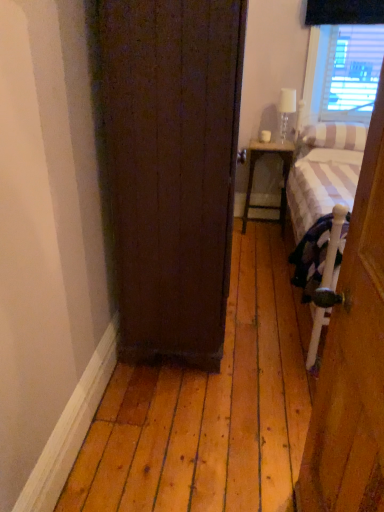
Question: From a real-world perspective, is white striped pillow at right, the 1th pillow when ordered from top to bottom, below dark wood door at center, arranged as the second door when viewed from the front?

Choices:
 (A) no
 (B) yes

Answer: (A)

Question: From the image's perspective, is white striped pillow at right, the 1th pillow when ordered from top to bottom, over dark wood door at center, arranged as the second door when viewed from the front?

Choices:
 (A) yes
 (B) no

Answer: (A)

Question: Is white striped pillow at right, the 1th pillow when ordered from top to bottom, placed right next to dark wood door at center, which is the 2th door from right to left?

Choices:
 (A) no
 (B) yes

Answer: (A)

Question: Does white striped pillow at right, placed as the second pillow when sorted from bottom to top, have a lesser height compared to dark wood door at center, arranged as the second door when viewed from the front?

Choices:
 (A) no
 (B) yes

Answer: (B)

Question: Is white striped pillow at right, the 1th pillow when ordered from top to bottom, facing towards dark wood door at center, placed as the 1th door when sorted from left to right?

Choices:
 (A) yes
 (B) no

Answer: (B)

Question: Which is correct: white striped pillow at right, which is the second pillow in top-to-bottom order, is inside white striped fabric bed at right, or outside of it?

Choices:
 (A) outside
 (B) inside

Answer: (B)

Question: Is point (304, 155) closer or farther from the camera than point (312, 142)?

Choices:
 (A) closer
 (B) farther

Answer: (B)

Question: Considering the positions of white striped pillow at right, which is the second pillow in top-to-bottom order, and white striped fabric bed at right in the image, is white striped pillow at right, which is the second pillow in top-to-bottom order, bigger or smaller than white striped fabric bed at right?

Choices:
 (A) small
 (B) big

Answer: (A)

Question: Is white striped pillow at right, which is the first pillow from bottom to top, in front of or behind white striped fabric bed at right in the image?

Choices:
 (A) behind
 (B) front

Answer: (A)

Question: Looking at the image, does white striped pillow at right, which is the first pillow from bottom to top, seem bigger or smaller compared to dark wood door at center, which is the 2th door from right to left?

Choices:
 (A) small
 (B) big

Answer: (A)

Question: Looking at their shapes, would you say white striped pillow at right, which is the first pillow from bottom to top, is wider or thinner than dark wood door at center, the 1th door in the back-to-front sequence?

Choices:
 (A) wide
 (B) thin

Answer: (B)

Question: Is point coord(314,158) positioned closer to the camera than point coord(215,314)?

Choices:
 (A) farther
 (B) closer

Answer: (A)

Question: Do you think white striped pillow at right, which is the second pillow in top-to-bottom order, is within dark wood door at center, arranged as the second door when viewed from the front, or outside of it?

Choices:
 (A) outside
 (B) inside

Answer: (A)

Question: Which is correct: white striped pillow at right, which is the first pillow from bottom to top, is inside wooden door at right, positioned as the 1th door in right-to-left order, or outside of it?

Choices:
 (A) outside
 (B) inside

Answer: (A)

Question: Is white striped pillow at right, which is the second pillow in top-to-bottom order, bigger or smaller than wooden door at right, the first door viewed from the front?

Choices:
 (A) small
 (B) big

Answer: (A)